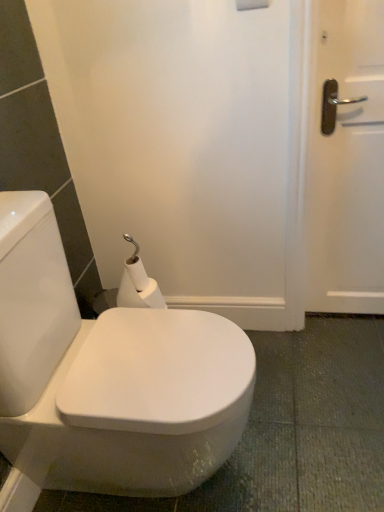
Question: From a real-world perspective, is white glossy bidet at center positioned above or below white matte toilet paper at center?

Choices:
 (A) above
 (B) below

Answer: (B)

Question: In the image, is white glossy bidet at center positioned in front of or behind white matte toilet paper at center?

Choices:
 (A) front
 (B) behind

Answer: (A)

Question: Is white glossy bidet at center situated inside white matte toilet paper at center or outside?

Choices:
 (A) outside
 (B) inside

Answer: (A)

Question: In terms of height, does white matte toilet paper at center look taller or shorter compared to white glossy bidet at center?

Choices:
 (A) tall
 (B) short

Answer: (B)

Question: From a real-world perspective, is white matte toilet paper at center above or below white glossy bidet at center?

Choices:
 (A) above
 (B) below

Answer: (A)

Question: Is white matte toilet paper at center to the left or to the right of white glossy bidet at center in the image?

Choices:
 (A) right
 (B) left

Answer: (B)

Question: Is point (130, 282) closer or farther from the camera than point (145, 330)?

Choices:
 (A) closer
 (B) farther

Answer: (B)